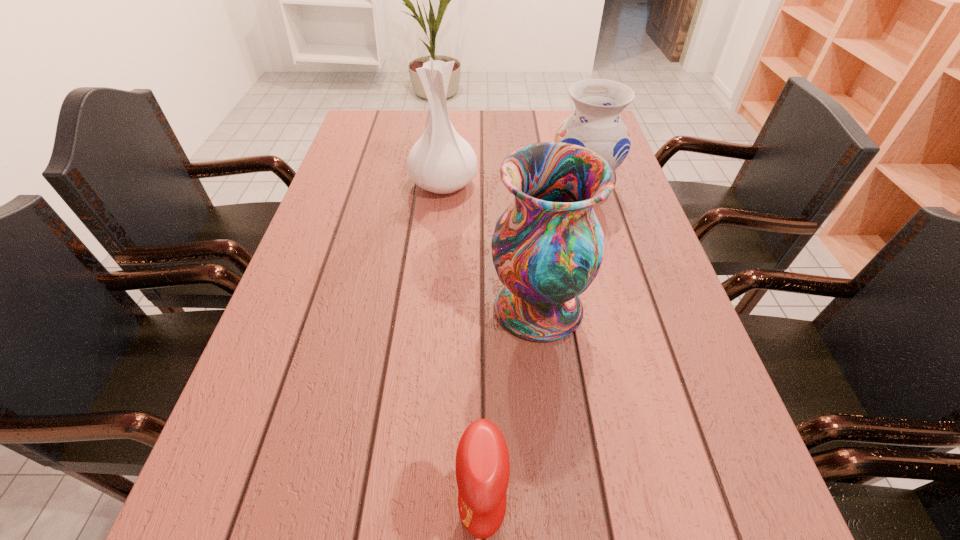
Locate an element on the screen. The image size is (960, 540). object that is the third closest one to the leftmost vase is located at coordinates (482, 466).

Identify which object is located as the third nearest to the third farthest object. Please provide its 2D coordinates. Your answer should be formatted as a tuple, i.e. [(x, y)], where the tuple contains the x and y coordinates of a point satisfying the conditions above.

[(441, 161)]

Locate an element on the screen. The image size is (960, 540). vase that is the closest to the leftmost vase is located at coordinates (596, 124).

Select which vase is the second closest to the third farthest object. Please provide its 2D coordinates. Your answer should be formatted as a tuple, i.e. [(x, y)], where the tuple contains the x and y coordinates of a point satisfying the conditions above.

[(441, 161)]